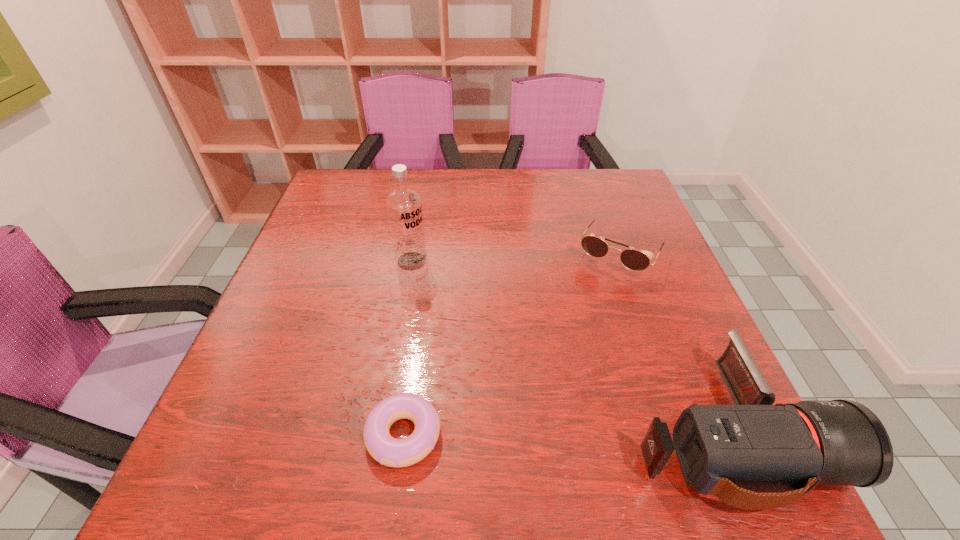
Where is `vacant space on the desktop that is between the shortest object and the camcorder and is positioned on the front label of the tallest object`? This screenshot has height=540, width=960. vacant space on the desktop that is between the shortest object and the camcorder and is positioned on the front label of the tallest object is located at coordinates (563, 434).

You are a GUI agent. You are given a task and a screenshot of the screen. Output one action in this format:
    pyautogui.click(x=<x>, y=<y>)
    Task: Click on the free spot on the desktop that is between the doughnut and the second tallest object and is positioned on the front lenses of the second shortest object
    The image size is (960, 540).
    Given the screenshot: What is the action you would take?
    pyautogui.click(x=517, y=434)